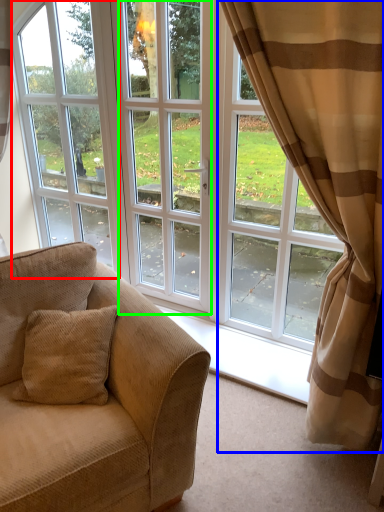
Question: Estimate the real-world distances between objects in this image. Which object is farther from window frame (highlighted by a red box), curtain (highlighted by a blue box) or screen door (highlighted by a green box)?

Choices:
 (A) curtain
 (B) screen door

Answer: (A)